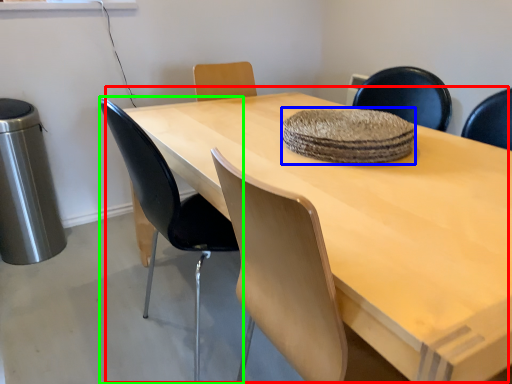
Question: Estimate the real-world distances between objects in this image. Which object is closer to table (highlighted by a red box), mat (highlighted by a blue box) or chair (highlighted by a green box)?

Choices:
 (A) mat
 (B) chair

Answer: (A)